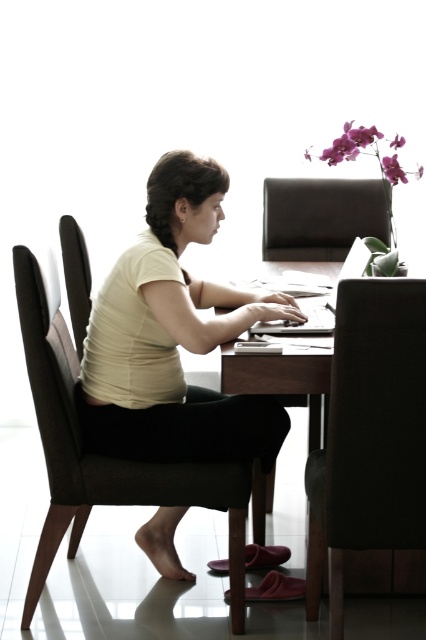
You are a person who is 1.7 meters tall. You want to sit on the brown leather chair at center and dark brown leather chair at left. Which chair will require you to climb higher to sit?

The brown leather chair at center is much taller than the dark brown leather chair at left, so you will need to climb higher to sit on the brown leather chair at center.

You are standing at the position of point (310, 204) and want to move to the position of point (62, 525). Which direction should you move in to reach your destination?

You should move forward because point (62, 525) is in front of point (310, 204).

You are planning to place a new table that requires a chair with a larger seating area. You are in a room with a brown leather chair at center and a brown fabric chair at center. Which chair should you choose?

The brown fabric chair at center has a larger size compared to the brown leather chair at center, so you should choose the brown fabric chair at center for the new table that requires a chair with a larger seating area.